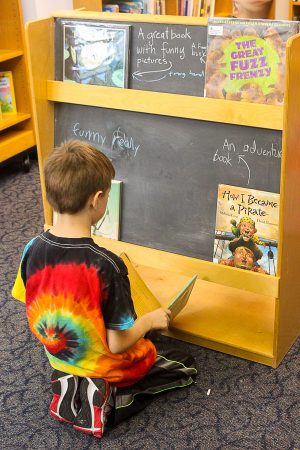
This screenshot has height=450, width=300. What are the coordinates of `book` in the screenshot? It's located at (178, 34).